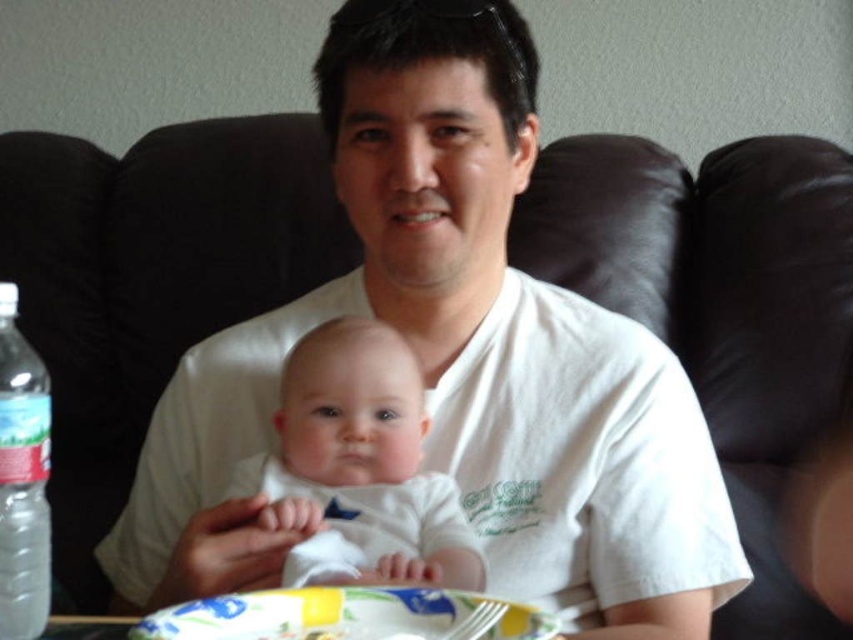
You are a photographer setting up a shot of the man and baby. You need to place a small prop between the yellow paper plate at lower center and the clear plastic bottle at left. Where should you place it to ensure it doesn

The yellow paper plate at lower center is positioned under the clear plastic bottle at left, so placing the prop between them would require positioning it below the bottle and above the plate.

You are a photographer setting up for a family portrait. You have a white soft fabric baby at center and a clear plastic bottle at left in the scene. Which object should you focus on first if you want to capture the larger subject in your shot?

The white soft fabric baby at center is larger in size compared to the clear plastic bottle at left, so you should focus on the white soft fabric baby at center first to capture the larger subject in your shot.

You are a photographer setting up for a family photo. You need to position a small prop between the white soft fabric baby at center and the clear plastic bottle at left. Where should you place the prop so it is between them?

The prop should be placed to the right of the clear plastic bottle at left and to the left of the white soft fabric baby at center since the baby is to the right of the bottle.